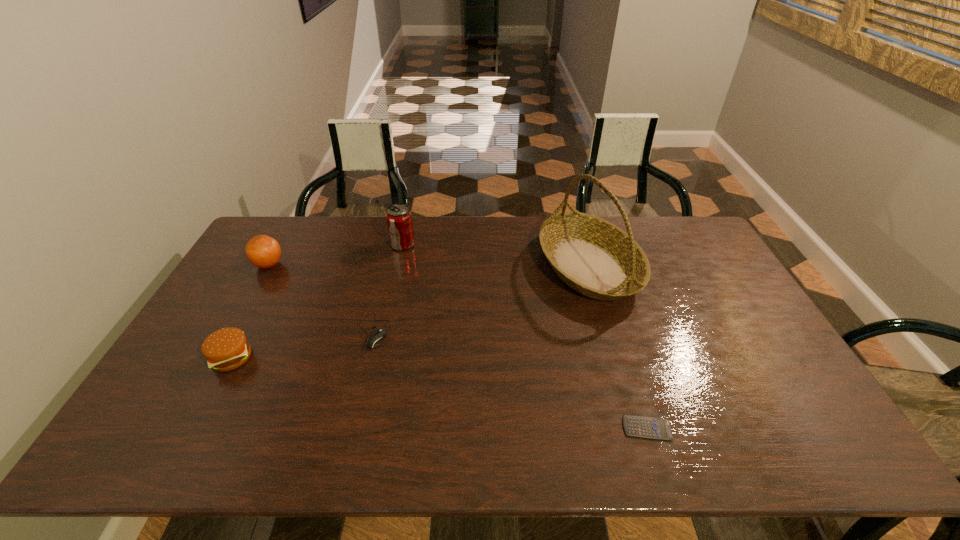
In the image, there is a desktop. Identify the location of vacant space at the far edge. The width and height of the screenshot is (960, 540). (345, 227).

The image size is (960, 540). Find the location of `free spot at the near edge of the desktop`. free spot at the near edge of the desktop is located at coordinates click(321, 424).

In the image, there is a desktop. Where is `vacant space at the left edge`? vacant space at the left edge is located at coordinates (179, 393).

Find the location of a particular element. The width and height of the screenshot is (960, 540). vacant position at the right edge of the desktop is located at coordinates (818, 413).

In the image, there is a desktop. Identify the location of vacant area at the far right corner. (651, 219).

Find the location of a particular element. vacant point located between the hamburger and the second shortest object is located at coordinates (302, 345).

This screenshot has height=540, width=960. I want to click on blank region between the third shortest object and the basket, so click(410, 312).

Locate an element on the screen. The width and height of the screenshot is (960, 540). vacant space that is in between the fifth shortest object and the nearest object is located at coordinates (525, 336).

Where is `vacant space that's between the nearest object and the fourth tallest object`? The height and width of the screenshot is (540, 960). vacant space that's between the nearest object and the fourth tallest object is located at coordinates click(440, 393).

At what (x,y) coordinates should I click in order to perform the action: click on vacant region between the computer mouse and the calculator. Please return your answer as a coordinate pair (x, y). Looking at the image, I should click on (510, 380).